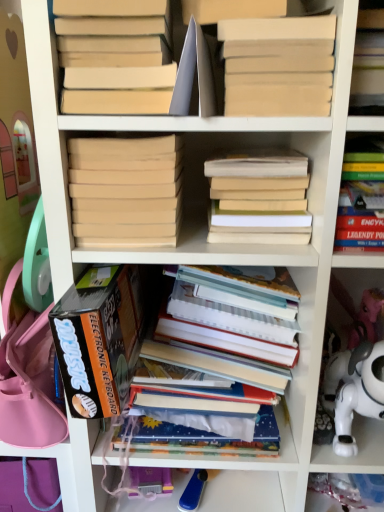
Question: In the image, is hardcover books at center, which is counted as the 4th book, starting from the left, positioned in front of or behind white plastic toy at lower right?

Choices:
 (A) front
 (B) behind

Answer: (B)

Question: From a real-world perspective, is hardcover books at center, which is counted as the 4th book, starting from the left, above or below white plastic toy at lower right?

Choices:
 (A) above
 (B) below

Answer: (A)

Question: Estimate the real-world distances between objects in this image. Which object is farther from the beige cardboard book at upper center, which is counted as the fifth book, starting from the left?

Choices:
 (A) hardcover books at center, which is counted as the 4th book, starting from the left
 (B) matte beige book at upper left, placed as the 3th book when sorted from left to right
 (C) white plastic toy at lower right
 (D) hardcover book at upper right, the 7th book positioned from the left
 (E) black cardboard box at lower left, placed as the 1th book when sorted from left to right

Answer: (C)

Question: Which object is positioned closest to the black cardboard box at lower left, placed as the 1th book when sorted from left to right?

Choices:
 (A) beige matte book at center, which is the second book from left to right
 (B) hardcover books at center, which is counted as the 4th book, starting from the left
 (C) light brown matte book at center, placed as the 2th book when sorted from right to left
 (D) hardcover book at upper right, positioned as the first book in right-to-left order
 (E) beige cardboard book at upper center, which is counted as the fifth book, starting from the left

Answer: (B)